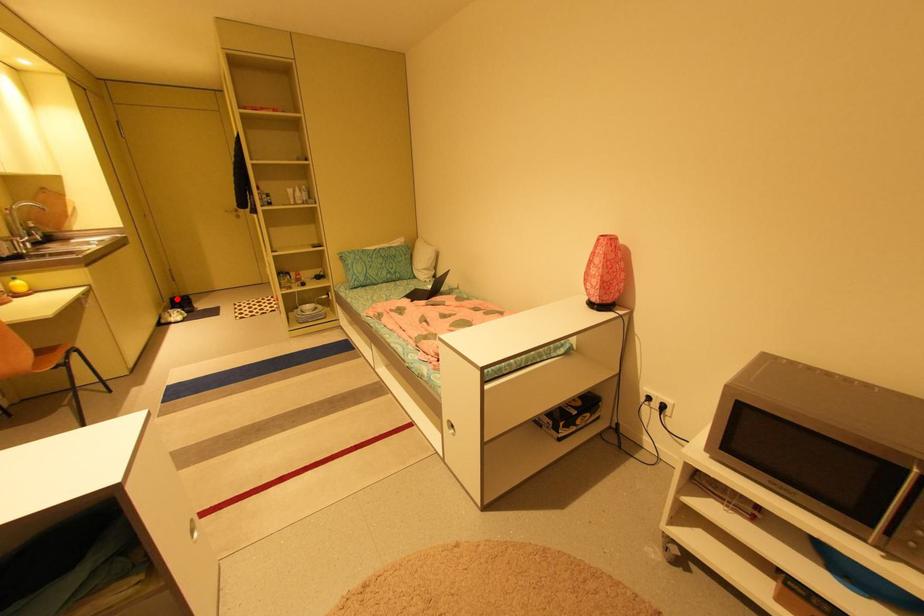
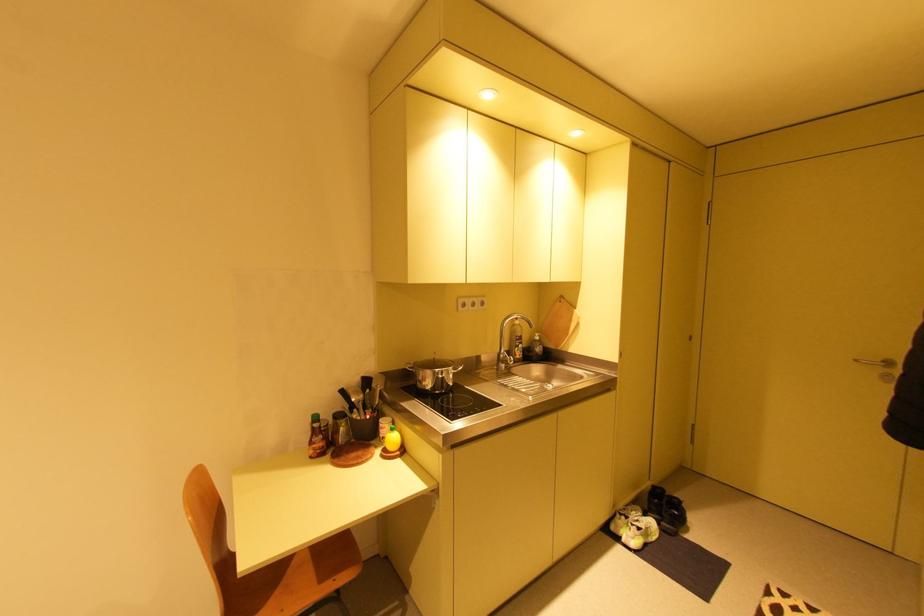
Find the pixel in the second image that matches the highlighted location in the first image.

(660, 487)